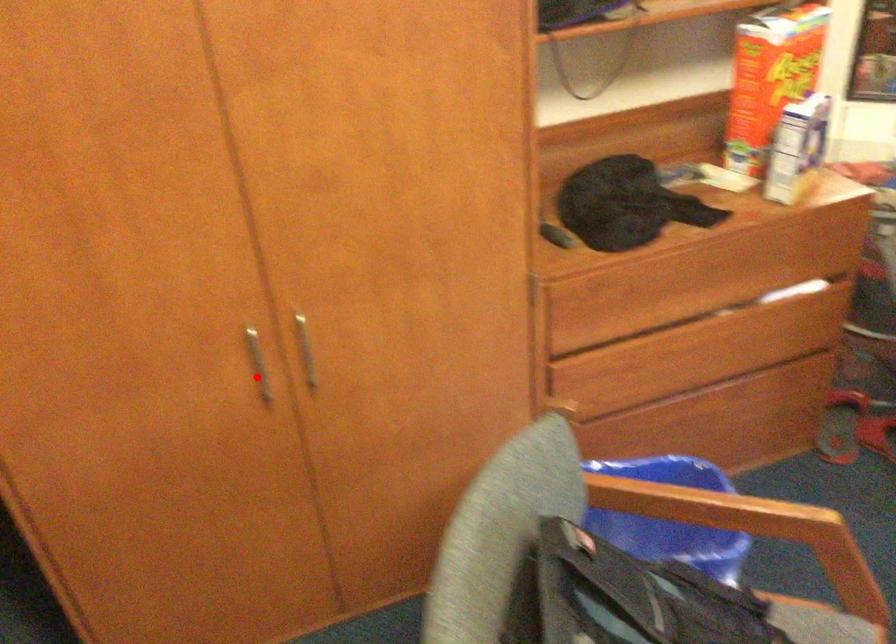
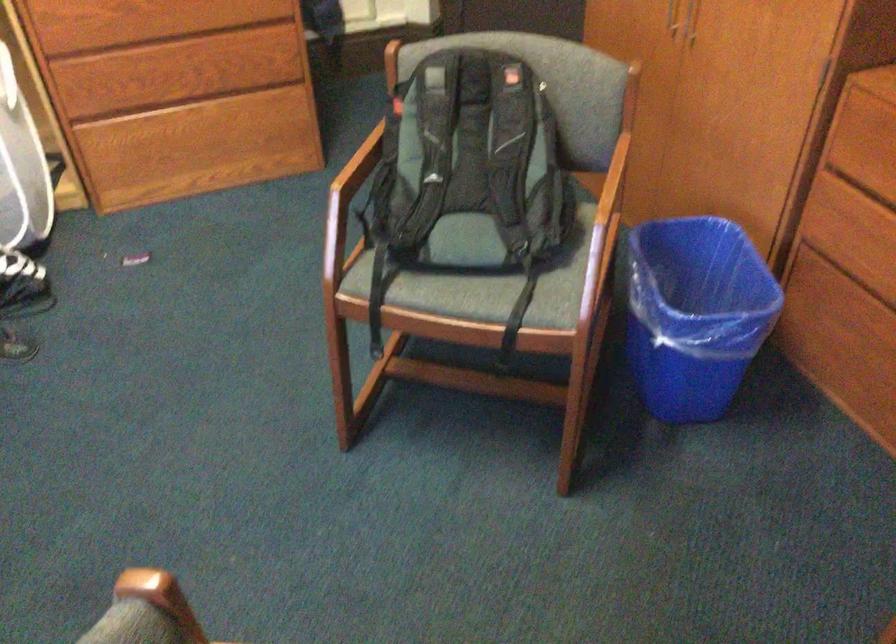
Question: I am providing you with two images of the same scene from different viewpoints. In image1, a red point is highlighted. Considering the same 3D point in image2, which of the following is correct?

Choices:
 (A) It is closer
 (B) It is farther

Answer: (B)